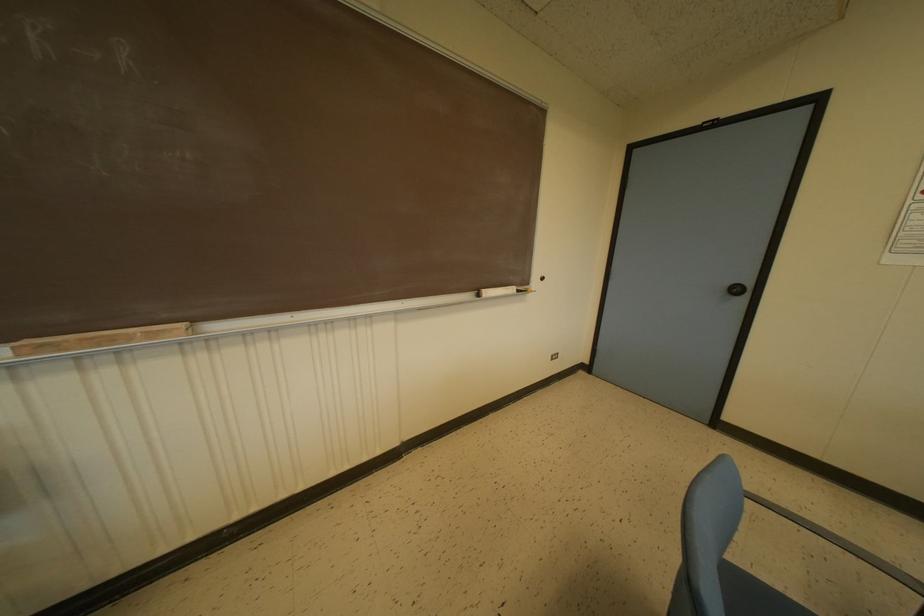
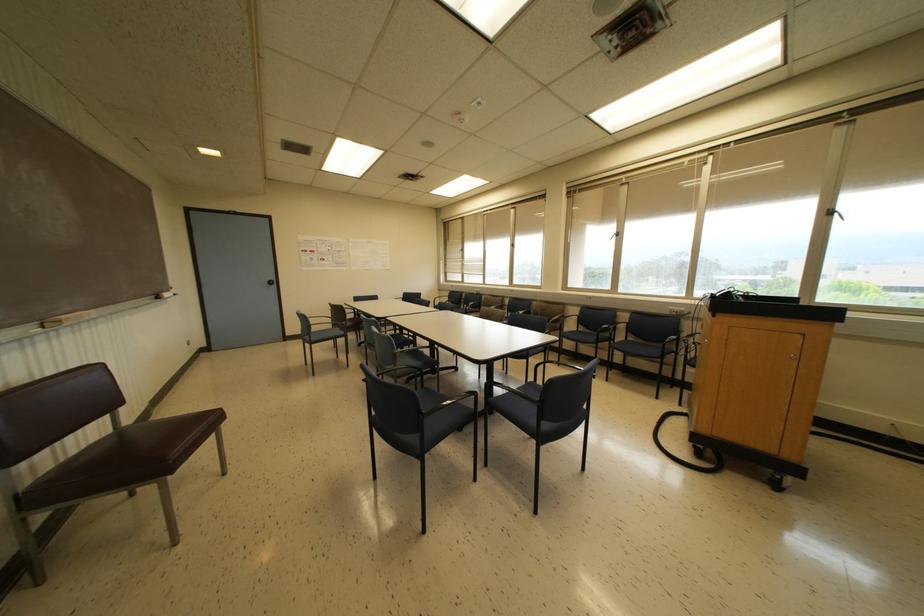
The point at [478,294] is marked in the first image. Where is the corresponding point in the second image?

(157, 297)